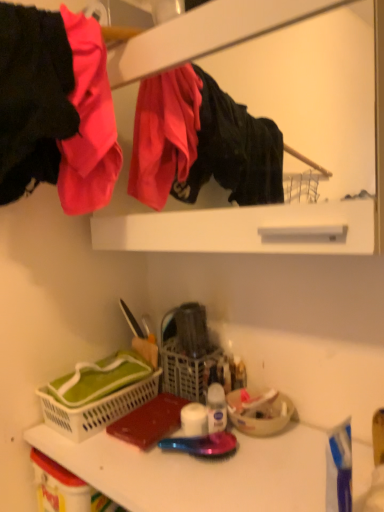
Question: In terms of width, does matte black jacket at upper left look wider or thinner when compared to matte white medicine cabinet at upper center?

Choices:
 (A) thin
 (B) wide

Answer: (B)

Question: From the image's perspective, is matte black jacket at upper left positioned above or below matte white medicine cabinet at upper center?

Choices:
 (A) below
 (B) above

Answer: (B)

Question: Which object is the closest to the matte white medicine cabinet at upper center?

Choices:
 (A) white plastic basket at lower left
 (B) white plastic counter top at lower center
 (C) transparent plastic spray bottle at center
 (D) matte black jacket at upper left
 (E) white matte toilet paper at center

Answer: (D)

Question: Based on their relative distances, which object is nearer to the white plastic counter top at lower center?

Choices:
 (A) matte black jacket at upper left
 (B) white plastic basket at lower left
 (C) transparent plastic spray bottle at center
 (D) matte white medicine cabinet at upper center
 (E) white matte toilet paper at center

Answer: (E)